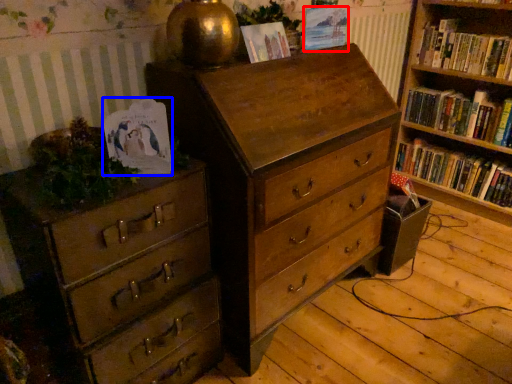
Question: Among these objects, which one is nearest to the camera, paperback book (highlighted by a red box) or paperback book (highlighted by a blue box)?

Choices:
 (A) paperback book
 (B) paperback book

Answer: (B)